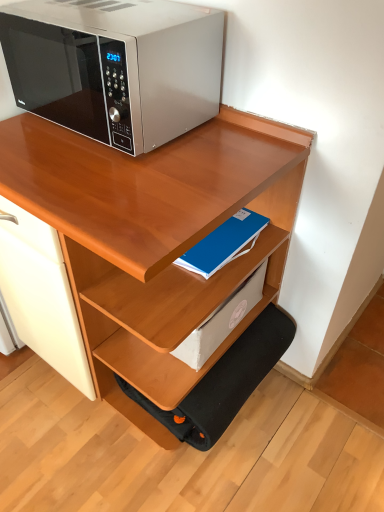
Question: From the image's perspective, is satin silver microwave at upper left positioned above or below black fabric step stool at lower center?

Choices:
 (A) below
 (B) above

Answer: (B)

Question: From a real-world perspective, is satin silver microwave at upper left positioned above or below black fabric step stool at lower center?

Choices:
 (A) above
 (B) below

Answer: (A)

Question: Which of these objects is positioned farthest from the blue matte paper at center, acting as the 1th paperback book starting from the bottom?

Choices:
 (A) wooden desk at upper center
 (B) blue matte notebook at center, the 1th paperback book viewed from the top
 (C) black fabric step stool at lower center
 (D) satin silver microwave at upper left

Answer: (D)

Question: Which object is positioned farthest from the blue matte notebook at center, positioned as the second paperback book in bottom-to-top order?

Choices:
 (A) satin silver microwave at upper left
 (B) black fabric step stool at lower center
 (C) wooden desk at upper center
 (D) blue matte paper at center, the second paperback book when ordered from top to bottom

Answer: (A)